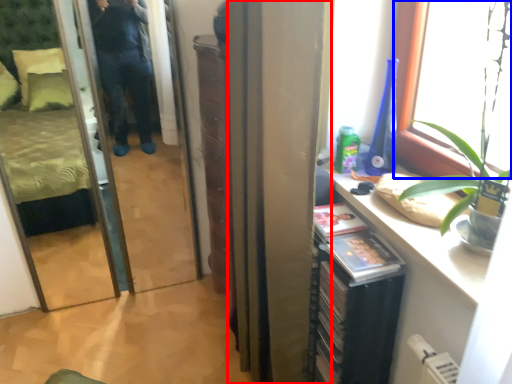
Question: Which of the following is the closest to the observer, curtain (highlighted by a red box) or window (highlighted by a blue box)?

Choices:
 (A) curtain
 (B) window

Answer: (B)